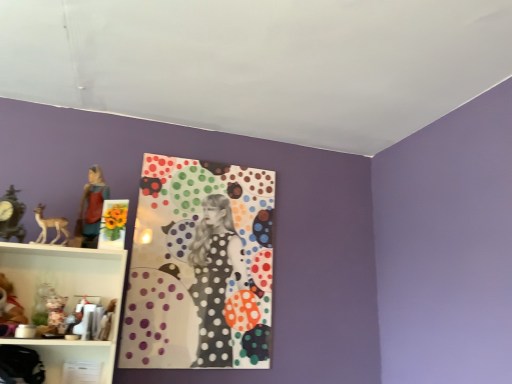
Question: Does matte brown deer at left have a greater height compared to matte black clock at left?

Choices:
 (A) no
 (B) yes

Answer: (A)

Question: From the image's perspective, is matte brown deer at left over matte black clock at left?

Choices:
 (A) yes
 (B) no

Answer: (B)

Question: Are matte brown deer at left and matte black clock at left located far from each other?

Choices:
 (A) no
 (B) yes

Answer: (A)

Question: Considering the relative positions of matte brown deer at left and matte black clock at left in the image provided, is matte brown deer at left to the left of matte black clock at left from the viewer's perspective?

Choices:
 (A) yes
 (B) no

Answer: (B)

Question: From the image's perspective, is matte brown deer at left below matte black clock at left?

Choices:
 (A) yes
 (B) no

Answer: (A)

Question: Is matte brown deer at left outside matte black clock at left?

Choices:
 (A) no
 (B) yes

Answer: (B)

Question: Does polka dot fabric at center have a greater width compared to matte black bag at lower left?

Choices:
 (A) yes
 (B) no

Answer: (B)

Question: Does polka dot fabric at center turn towards matte black bag at lower left?

Choices:
 (A) no
 (B) yes

Answer: (A)

Question: Are polka dot fabric at center and matte black bag at lower left far apart?

Choices:
 (A) no
 (B) yes

Answer: (A)

Question: From the image's perspective, is polka dot fabric at center on matte black bag at lower left?

Choices:
 (A) yes
 (B) no

Answer: (A)

Question: Can matte black bag at lower left be found inside polka dot fabric at center?

Choices:
 (A) yes
 (B) no

Answer: (B)

Question: Considering the relative sizes of polka dot fabric at center and matte black bag at lower left in the image provided, is polka dot fabric at center smaller than matte black bag at lower left?

Choices:
 (A) yes
 (B) no

Answer: (B)

Question: Is matte brown statue at left positioned beyond the bounds of polka dot fabric at center?

Choices:
 (A) no
 (B) yes

Answer: (B)